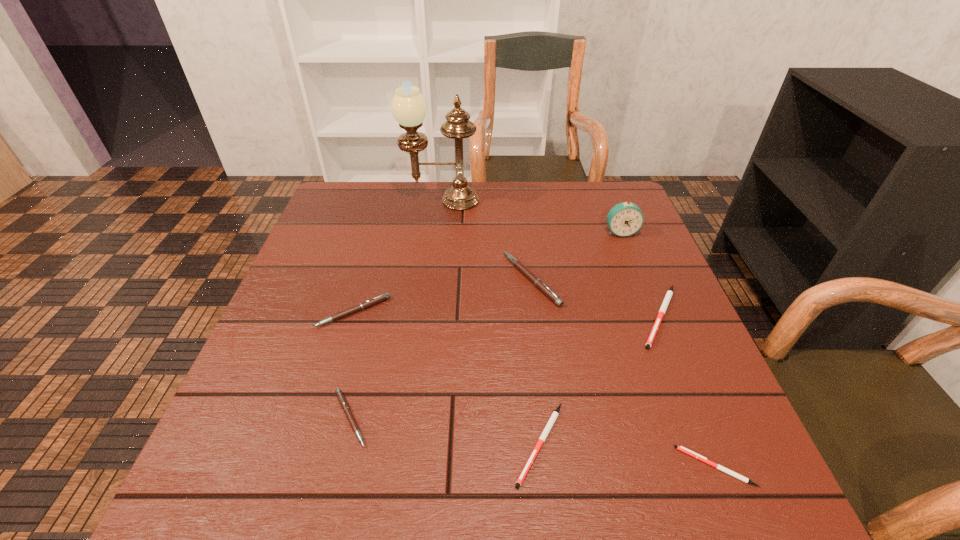
This screenshot has height=540, width=960. In order to click on vacant space located 0.370m on the clicker of the shortest object in this screenshot , I will do `click(457, 467)`.

Locate an element on the screen. free spot located on the clicker of the shortest object is located at coordinates [547, 467].

The image size is (960, 540). In order to click on free space located on the clicker of the shortest object in this screenshot , I will do `click(536, 467)`.

Where is `oil lamp present at the far edge`? This screenshot has width=960, height=540. oil lamp present at the far edge is located at coordinates (408, 107).

This screenshot has height=540, width=960. In order to click on alarm clock present at the far edge in this screenshot , I will do `click(624, 219)`.

Locate an element on the screen. The image size is (960, 540). object situated at the left edge is located at coordinates (380, 298).

The image size is (960, 540). Identify the location of alarm clock situated at the right edge. (624, 219).

I want to click on object present at the far right corner, so click(624, 219).

You are a GUI agent. You are given a task and a screenshot of the screen. Output one action in this format:
    pyautogui.click(x=<x>, y=<y>)
    Task: Click on the object positioned at the near right corner
    Image resolution: width=960 pixels, height=540 pixels.
    Given the screenshot: What is the action you would take?
    pyautogui.click(x=683, y=449)

Identify the location of vacant space at the far edge. The image size is (960, 540). (531, 193).